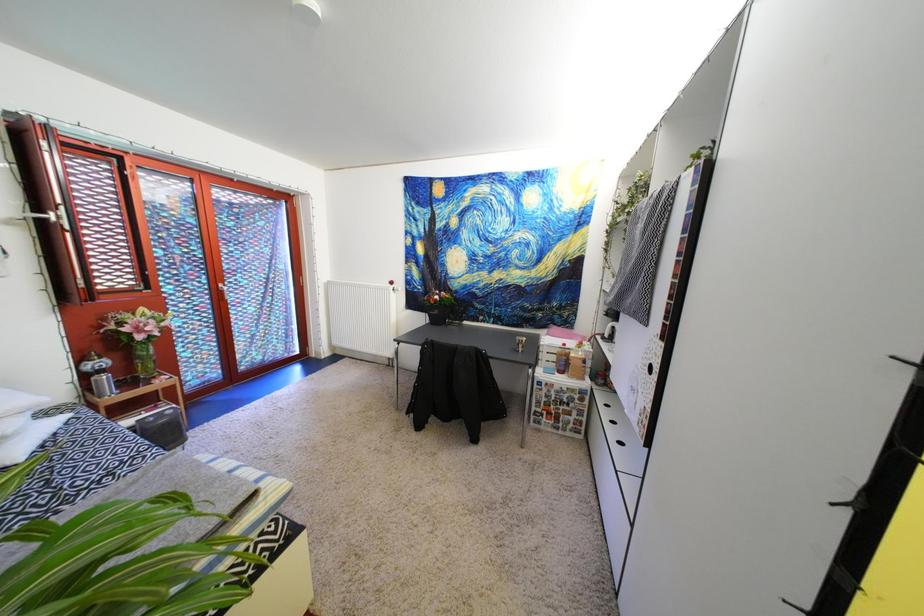
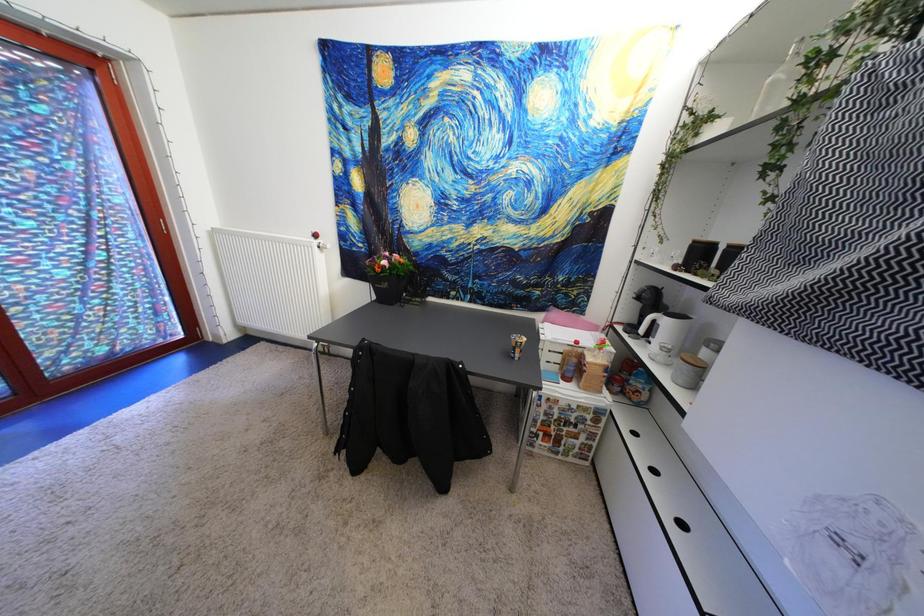
Question: Based on the continuous images, in which direction is the camera rotating? Reply with the corresponding letter.

Choices:
 (A) Left
 (B) Right
 (C) Up
 (D) Down

Answer: (D)